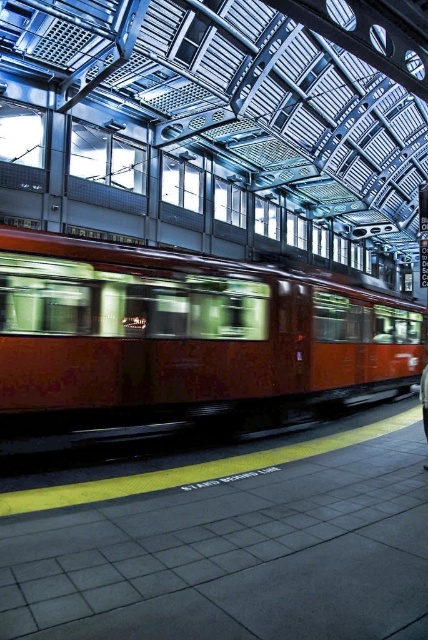
You are a passenger waiting at the train station platform. You notice a matte orange train at center and a dark blue jeans at center. Which object is wider?

The matte orange train at center is wider than the dark blue jeans at center.

You are a passenger waiting at the train station. You see the matte orange train at center and the dark blue jeans at center. Which object is taller?

The matte orange train at center is much taller as dark blue jeans at center.

Looking at this image, you are a passenger waiting at the train station platform. You see the matte orange train at center and the dark blue jeans at center. Which object is closer to the edge of the platform where the yellow tactile strip is located?

The matte orange train at center is positioned on the left side of dark blue jeans at center. Since the train is moving and likely near the edge, it is closer to the yellow tactile strip than the dark blue jeans at center.